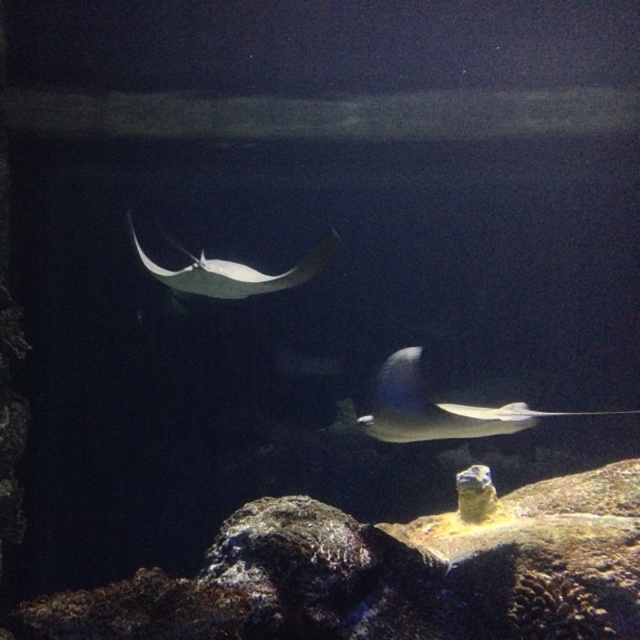
You are an underwater photographer aiming to capture both the glossy blue stingray at center and the white glossy stingray at center in a single frame. Which stingray should you focus on first to ensure both fit in the shot?

The glossy blue stingray at center occupies less space than the white glossy stingray at center, so you should focus on the white glossy stingray at center first to ensure both fit in the shot.

You are a marine biologist observing an underwater scene. You notice a point marked at coordinates (x=432, y=408). What object is located at this point?

The point at coordinates (x=432, y=408) marks the glossy blue stingray at center.

You are a marine biologist observing the two stingrays in the aquarium. You need to determine if they are close enough to interact without disturbing each other. The minimum safe distance for interaction between stingrays is 20 inches. Can the glossy blue stingray at center and the white glossy stingray at center interact safely?

The glossy blue stingray at center and the white glossy stingray at center are 22.40 inches apart from each other. Since the minimum safe distance is 20 inches, they can interact safely as they are within the required distance.